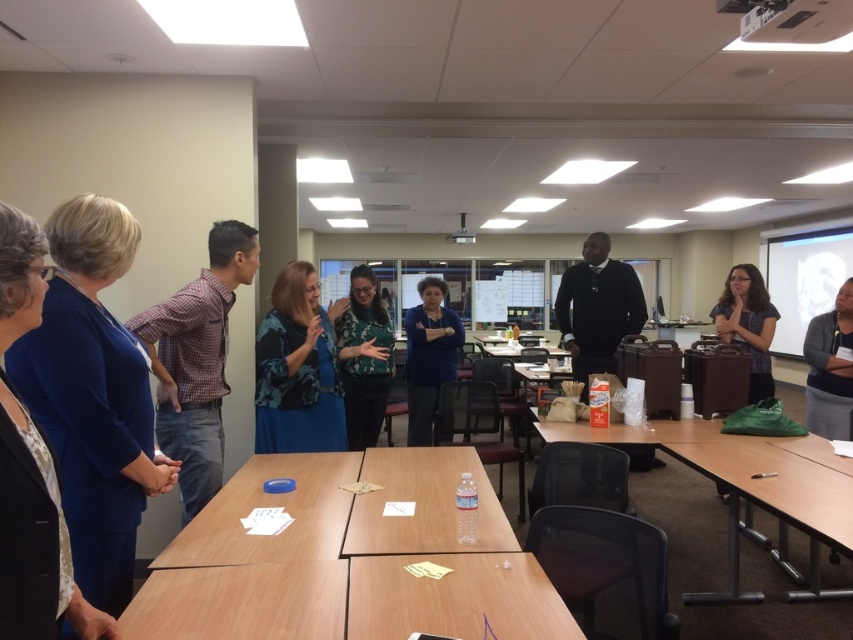
Can you confirm if wooden table at center is wider than blue fabric shirt at center?

Yes, wooden table at center is wider than blue fabric shirt at center.

Can you confirm if wooden table at center is smaller than blue fabric shirt at center?

Yes, wooden table at center is smaller than blue fabric shirt at center.

Describe the element at coordinates (347, 560) in the screenshot. I see `wooden table at center` at that location.

Where is `wooden table at center`? This screenshot has width=853, height=640. wooden table at center is located at coordinates (347, 560).

Does wooden table at center have a larger size compared to blue fabric jacket at left?

Yes, wooden table at center is bigger than blue fabric jacket at left.

Which is below, wooden table at center or blue fabric jacket at left?

wooden table at center is lower down.

You are a GUI agent. You are given a task and a screenshot of the screen. Output one action in this format:
    pyautogui.click(x=<x>, y=<y>)
    Task: Click on the wooden table at center
    The height and width of the screenshot is (640, 853).
    Given the screenshot: What is the action you would take?
    pyautogui.click(x=347, y=560)

Which is more to the left, green fabric bag at lower right or blue fabric shirt at center?

blue fabric shirt at center is more to the left.

Does green fabric bag at lower right have a larger size compared to blue fabric shirt at center?

Correct, green fabric bag at lower right is larger in size than blue fabric shirt at center.

Is point (613, 440) positioned in front of point (409, 401)?

Yes, it is.

You are a GUI agent. You are given a task and a screenshot of the screen. Output one action in this format:
    pyautogui.click(x=<x>, y=<y>)
    Task: Click on the green fabric bag at lower right
    
    Given the screenshot: What is the action you would take?
    pyautogui.click(x=749, y=486)